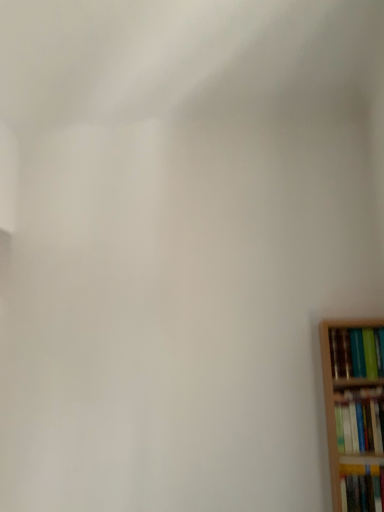
Question: From a real-world perspective, relative to hardcover book at right, the second book in the top-to-bottom sequence, is hardcover book at lower right, positioned as the first book in bottom-to-top order, vertically above or below?

Choices:
 (A) above
 (B) below

Answer: (B)

Question: Would you say hardcover book at lower right, the third book in the top-to-bottom sequence, is to the left or to the right of hardcover book at right, the second book in the top-to-bottom sequence, in the picture?

Choices:
 (A) right
 (B) left

Answer: (A)

Question: Which object is the farthest from the hardcover book at lower right, positioned as the first book in bottom-to-top order?

Choices:
 (A) hardcover book at right, the second book in the top-to-bottom sequence
 (B) hardcover book at right, the first book when ordered from top to bottom

Answer: (B)

Question: Based on their relative distances, which object is nearer to the hardcover book at right, the second book in the top-to-bottom sequence?

Choices:
 (A) hardcover book at lower right, positioned as the first book in bottom-to-top order
 (B) hardcover book at right, the first book when ordered from top to bottom

Answer: (A)